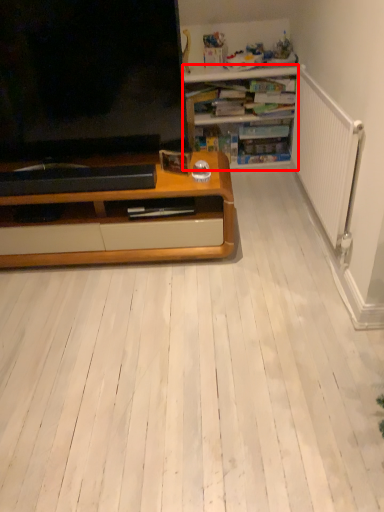
Question: Where is desk (annotated by the red box) located in relation to television in the image?

Choices:
 (A) left
 (B) right

Answer: (B)